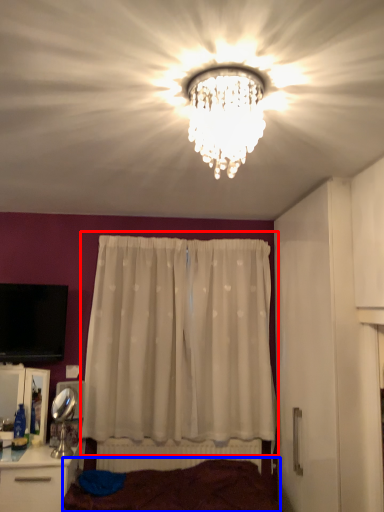
Question: Which object appears farthest to the camera in this image, curtain (highlighted by a red box) or bed frame (highlighted by a blue box)?

Choices:
 (A) curtain
 (B) bed frame

Answer: (A)